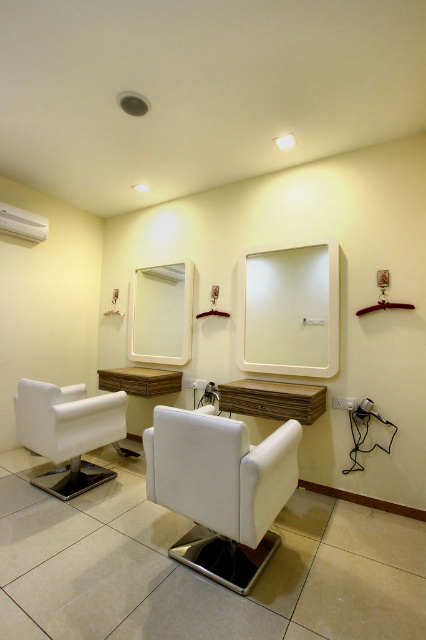
Is white leather armchair at center closer to camera compared to white plastic faucet at center?

Yes.

Measure the distance between white leather armchair at center and camera.

white leather armchair at center and camera are 5.79 feet apart from each other.

Find the location of a particular element. The width and height of the screenshot is (426, 640). white leather armchair at center is located at coordinates (221, 490).

Between white leather armchair at center and white glossy mirror at center, which one has more height?

Standing taller between the two is white glossy mirror at center.

From the picture: Does white leather armchair at center appear on the right side of white glossy mirror at center?

Incorrect, white leather armchair at center is not on the right side of white glossy mirror at center.

Describe the element at coordinates (221, 490) in the screenshot. I see `white leather armchair at center` at that location.

Where is `white leather armchair at center`? This screenshot has height=640, width=426. white leather armchair at center is located at coordinates (221, 490).

Does white leather armchair at center come behind white leather armchair at lower left?

No, white leather armchair at center is in front of white leather armchair at lower left.

Can you confirm if white leather armchair at center is positioned to the left of white leather armchair at lower left?

No, white leather armchair at center is not to the left of white leather armchair at lower left.

Find the location of `white leather armchair at center`. white leather armchair at center is located at coordinates (221, 490).